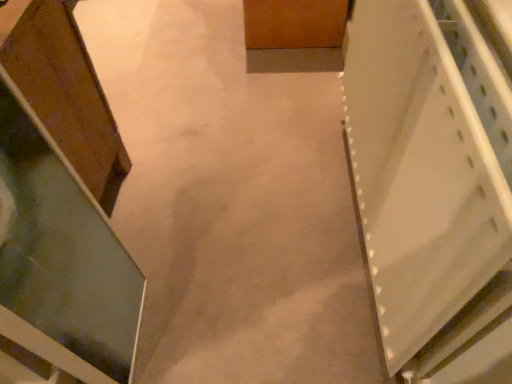
Question: From a real-world perspective, is white plastic shelf at right, the first cabinetry in the right-to-left sequence, physically located above or below wooden cabinet at left, which is the 2th cabinetry in right-to-left order?

Choices:
 (A) above
 (B) below

Answer: (A)

Question: Considering the positions of point (423, 54) and point (44, 0), is point (423, 54) closer or farther from the camera than point (44, 0)?

Choices:
 (A) closer
 (B) farther

Answer: (A)

Question: Is white plastic shelf at right, which ranks as the second cabinetry in left-to-right order, in front of or behind wooden cabinet at left, the first cabinetry positioned from the left, in the image?

Choices:
 (A) behind
 (B) front

Answer: (B)

Question: Does point (92, 87) appear closer or farther from the camera than point (483, 246)?

Choices:
 (A) farther
 (B) closer

Answer: (A)

Question: Based on their sizes in the image, would you say wooden cabinet at left, the first cabinetry positioned from the left, is bigger or smaller than white plastic shelf at right, the first cabinetry in the right-to-left sequence?

Choices:
 (A) big
 (B) small

Answer: (A)

Question: Considering the positions of wooden cabinet at left, which is the 2th cabinetry in right-to-left order, and white plastic shelf at right, which ranks as the second cabinetry in left-to-right order, in the image, is wooden cabinet at left, which is the 2th cabinetry in right-to-left order, taller or shorter than white plastic shelf at right, which ranks as the second cabinetry in left-to-right order,?

Choices:
 (A) short
 (B) tall

Answer: (B)

Question: Is wooden cabinet at left, the first cabinetry positioned from the left, spatially inside white plastic shelf at right, the first cabinetry in the right-to-left sequence, or outside of it?

Choices:
 (A) inside
 (B) outside

Answer: (B)